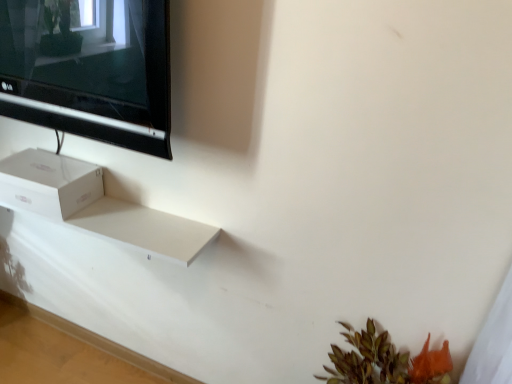
Find the location of `black glossy tv at upper left`. black glossy tv at upper left is located at coordinates (89, 70).

Image resolution: width=512 pixels, height=384 pixels. What do you see at coordinates (89, 70) in the screenshot?
I see `black glossy tv at upper left` at bounding box center [89, 70].

Describe the element at coordinates (49, 183) in the screenshot. The image size is (512, 384). I see `white cardboard box at lower left` at that location.

Image resolution: width=512 pixels, height=384 pixels. I want to click on white cardboard box at lower left, so click(x=49, y=183).

You are a GUI agent. You are given a task and a screenshot of the screen. Output one action in this format:
    pyautogui.click(x=<x>, y=<y>)
    Task: Click on the black glossy tv at upper left
    Image resolution: width=512 pixels, height=384 pixels.
    Given the screenshot: What is the action you would take?
    pyautogui.click(x=89, y=70)

Considering the positions of objects black glossy tv at upper left and white cardboard box at lower left in the image provided, who is more to the left, black glossy tv at upper left or white cardboard box at lower left?

white cardboard box at lower left is more to the left.

Considering their positions, is black glossy tv at upper left located in front of or behind white cardboard box at lower left?

black glossy tv at upper left is in front of white cardboard box at lower left.

Does point (38, 89) come behind point (42, 185)?

No, (38, 89) is in front of (42, 185).

Looking at this image, from the image's perspective, is black glossy tv at upper left above or below white cardboard box at lower left?

Clearly, from the image's perspective, black glossy tv at upper left is above white cardboard box at lower left.

From a real-world perspective, relative to white cardboard box at lower left, is black glossy tv at upper left vertically above or below?

Clearly, from a real-world perspective, black glossy tv at upper left is above white cardboard box at lower left.

Is black glossy tv at upper left wider or thinner than white cardboard box at lower left?

black glossy tv at upper left is thinner than white cardboard box at lower left.

In terms of height, does black glossy tv at upper left look taller or shorter compared to white cardboard box at lower left?

In the image, black glossy tv at upper left appears to be shorter than white cardboard box at lower left.

Which of these two, black glossy tv at upper left or white cardboard box at lower left, is smaller?

white cardboard box at lower left.

Which is correct: black glossy tv at upper left is inside white cardboard box at lower left, or outside of it?

black glossy tv at upper left is located beyond the bounds of white cardboard box at lower left.

Is black glossy tv at upper left beside white cardboard box at lower left?

No, black glossy tv at upper left is not making contact with white cardboard box at lower left.

Is black glossy tv at upper left turned away from white cardboard box at lower left?

No, white cardboard box at lower left is not at the back of black glossy tv at upper left.

What's the angular difference between black glossy tv at upper left and white cardboard box at lower left's facing directions?

There is a 1.18-degree angle between the facing directions of black glossy tv at upper left and white cardboard box at lower left.

Locate an element on the screen. The image size is (512, 384). television above the white cardboard box at lower left (from a real-world perspective) is located at coordinates (89, 70).

Considering the relative positions of white cardboard box at lower left and black glossy tv at upper left in the image provided, is white cardboard box at lower left to the left of black glossy tv at upper left from the viewer's perspective?

Yes, white cardboard box at lower left is to the left of black glossy tv at upper left.

Is white cardboard box at lower left closer to camera compared to black glossy tv at upper left?

No, white cardboard box at lower left is behind black glossy tv at upper left.

Which is nearer, (59, 171) or (74, 5)?

The point (74, 5) is closer.

From the image's perspective, is white cardboard box at lower left located above black glossy tv at upper left?

Actually, white cardboard box at lower left appears below black glossy tv at upper left in the image.

From a real-world perspective, is white cardboard box at lower left below black glossy tv at upper left?

Yes.

Considering the sizes of objects white cardboard box at lower left and black glossy tv at upper left in the image provided, who is thinner, white cardboard box at lower left or black glossy tv at upper left?

black glossy tv at upper left.

Who is taller, white cardboard box at lower left or black glossy tv at upper left?

Standing taller between the two is white cardboard box at lower left.

In terms of size, does white cardboard box at lower left appear bigger or smaller than black glossy tv at upper left?

In the image, white cardboard box at lower left appears to be smaller than black glossy tv at upper left.

Is white cardboard box at lower left surrounding black glossy tv at upper left?

No.

Would you say white cardboard box at lower left is a long distance from black glossy tv at upper left?

That's not correct — white cardboard box at lower left is a little close to black glossy tv at upper left.

Could you tell me if white cardboard box at lower left is facing black glossy tv at upper left?

No, white cardboard box at lower left does not turn towards black glossy tv at upper left.

How much distance is there between white cardboard box at lower left and black glossy tv at upper left?

white cardboard box at lower left is 12.60 inches from black glossy tv at upper left.

Locate an element on the screen. box located underneath the black glossy tv at upper left (from a real-world perspective) is located at coordinates (49, 183).

I want to click on television that appears above the white cardboard box at lower left (from the image's perspective), so click(89, 70).

Locate an element on the screen. This screenshot has height=384, width=512. box behind the black glossy tv at upper left is located at coordinates (49, 183).